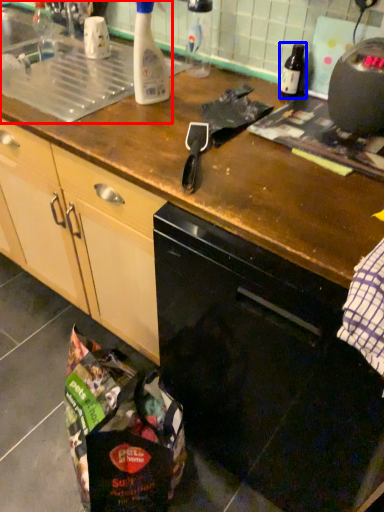
Question: Which object is further to the camera taking this photo, sink (highlighted by a red box) or bottle (highlighted by a blue box)?

Choices:
 (A) sink
 (B) bottle

Answer: (B)